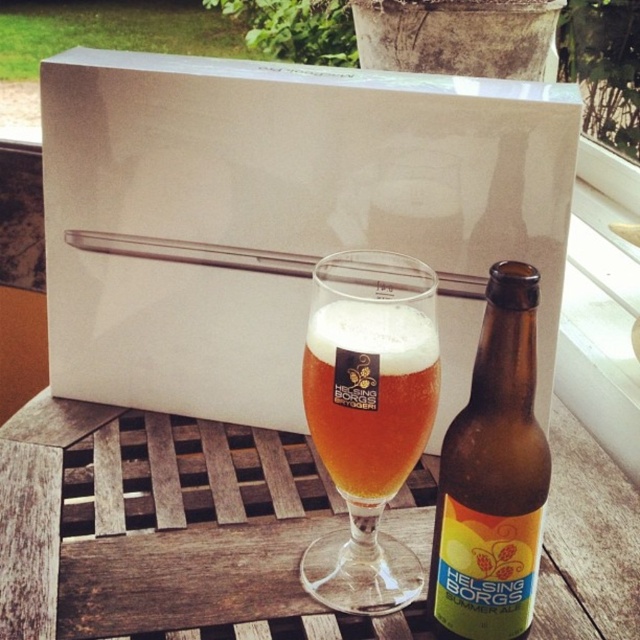
Based on the photo, is wooden slatted table at center in front of brown glass bottle at center?

No, it is behind brown glass bottle at center.

Between point (388, 524) and point (506, 278), which one is positioned behind?

Positioned behind is point (388, 524).

This screenshot has height=640, width=640. What do you see at coordinates (163, 529) in the screenshot? I see `wooden slatted table at center` at bounding box center [163, 529].

Locate an element on the screen. wooden slatted table at center is located at coordinates (163, 529).

Does brown glass bottle at center have a greater height compared to golden amber liquid at center?

Indeed, brown glass bottle at center has a greater height compared to golden amber liquid at center.

Who is positioned more to the right, brown glass bottle at center or golden amber liquid at center?

brown glass bottle at center is more to the right.

Is point (493, 400) closer to camera compared to point (388, 323)?

Yes, it is in front of point (388, 323).

Locate an element on the screen. brown glass bottle at center is located at coordinates (492, 476).

Is point (234, 451) farther from viewer compared to point (406, 452)?

Yes, point (234, 451) is farther from viewer.

Between wooden slatted table at center and golden amber liquid at center, which one appears on the left side from the viewer's perspective?

wooden slatted table at center is more to the left.

Between point (33, 412) and point (387, 476), which one is positioned in front?

Positioned in front is point (387, 476).

At what (x,y) coordinates should I click in order to perform the action: click on wooden slatted table at center. Please return your answer as a coordinate pair (x, y). This screenshot has height=640, width=640. Looking at the image, I should click on (163, 529).